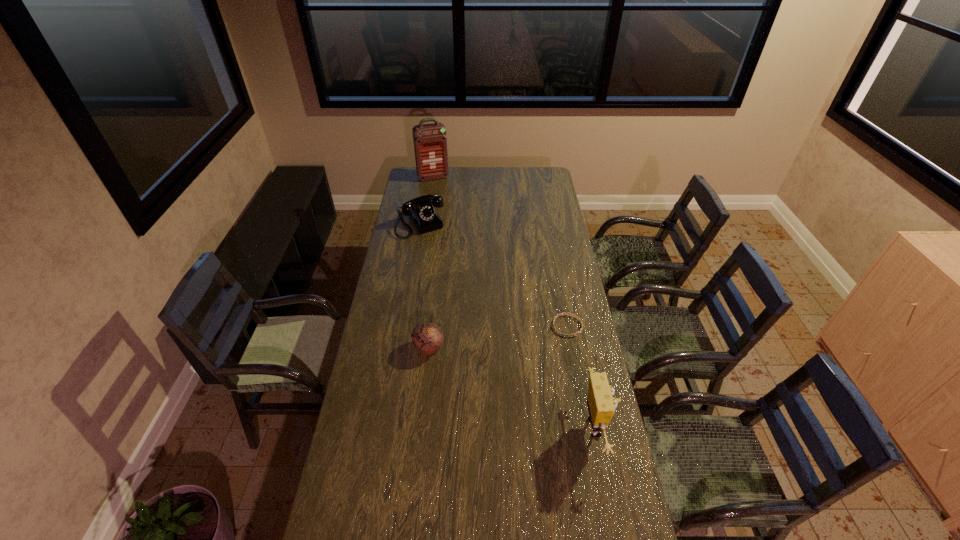
Identify the location of vacant point located between the muffin and the second tallest object. The width and height of the screenshot is (960, 540). pyautogui.click(x=513, y=387).

I want to click on free space between the muffin and the telephone, so click(424, 286).

Where is `unoccupied position between the muffin and the nearest object`? unoccupied position between the muffin and the nearest object is located at coordinates (513, 387).

Locate an element on the screen. The image size is (960, 540). free area in between the bracelet and the muffin is located at coordinates (498, 336).

This screenshot has width=960, height=540. In order to click on free space between the first-aid kit and the bracelet in this screenshot , I will do `click(500, 252)`.

Locate an element on the screen. This screenshot has height=540, width=960. free area in between the fourth nearest object and the sponge is located at coordinates (509, 326).

Locate an element on the screen. The height and width of the screenshot is (540, 960). free area in between the fourth shortest object and the telephone is located at coordinates (509, 326).

Select which object is the fourth closest to the fourth nearest object. Please provide its 2D coordinates. Your answer should be formatted as a tuple, i.e. [(x, y)], where the tuple contains the x and y coordinates of a point satisfying the conditions above.

[(601, 403)]

Image resolution: width=960 pixels, height=540 pixels. I want to click on object that ranks as the closest to the first-aid kit, so point(420,210).

Where is `vacant point that satisfies the following two spatial constraints: 1. on the front side of the third shortest object; 2. on the face of the sponge`? vacant point that satisfies the following two spatial constraints: 1. on the front side of the third shortest object; 2. on the face of the sponge is located at coordinates click(387, 427).